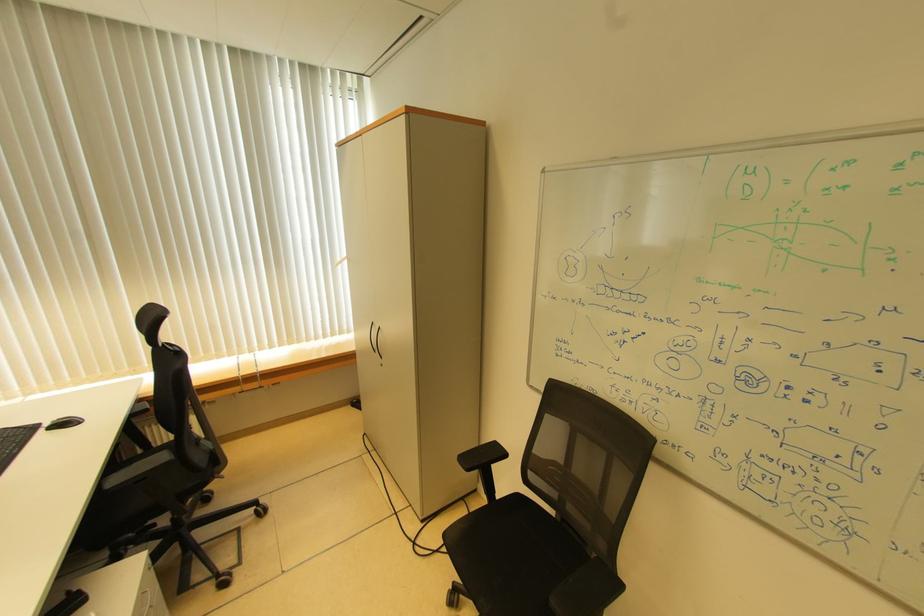
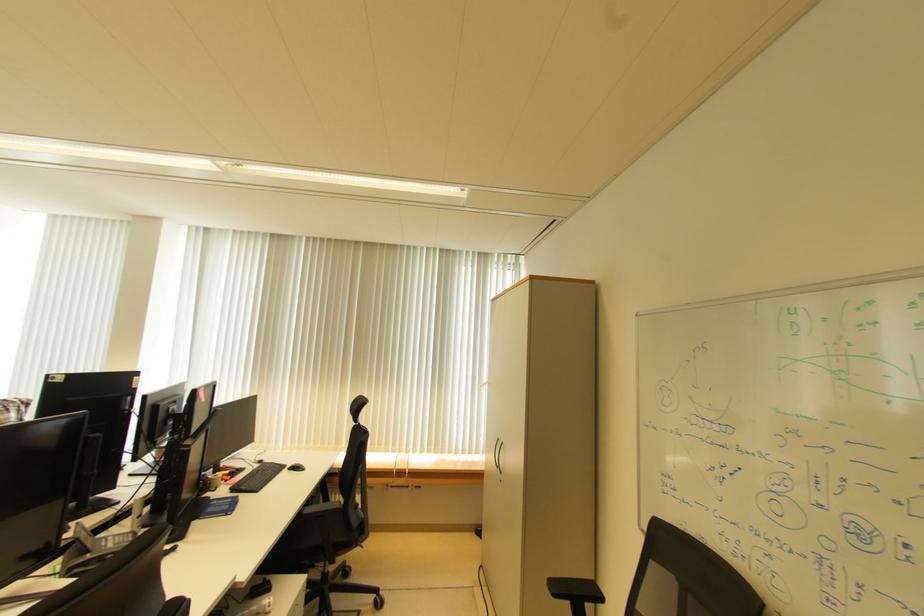
Locate, in the second image, the point that corresponds to (x=477, y=471) in the first image.

(564, 597)